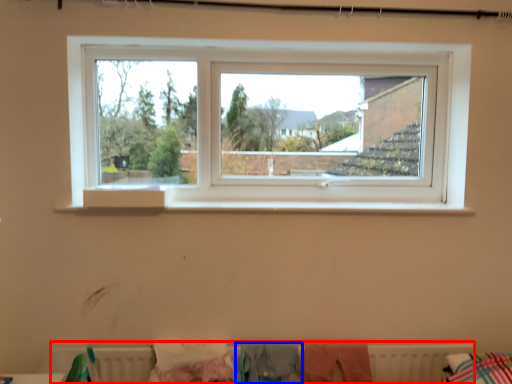
Question: Which point is further to the camera, radiator (highlighted by a red box) or clothing (highlighted by a blue box)?

Choices:
 (A) radiator
 (B) clothing

Answer: (A)